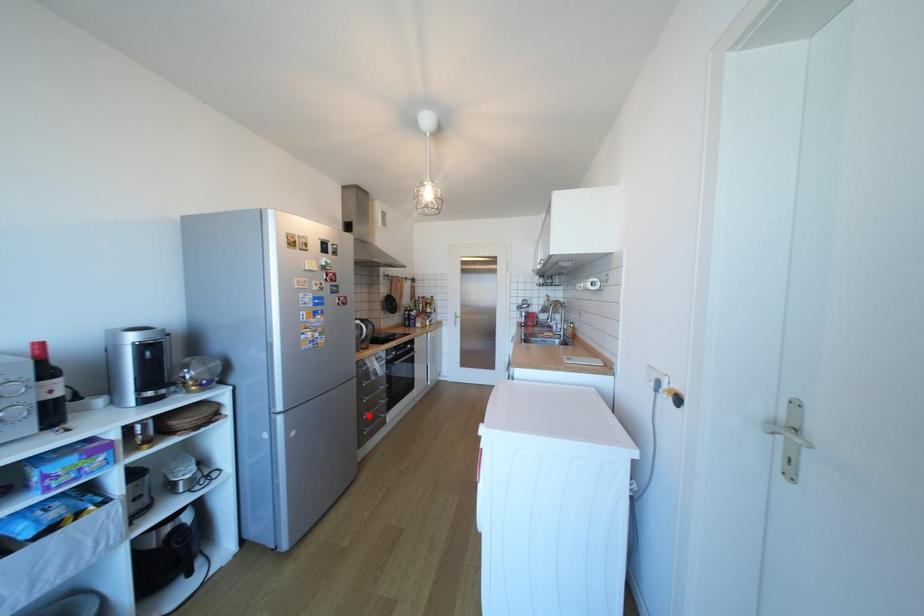
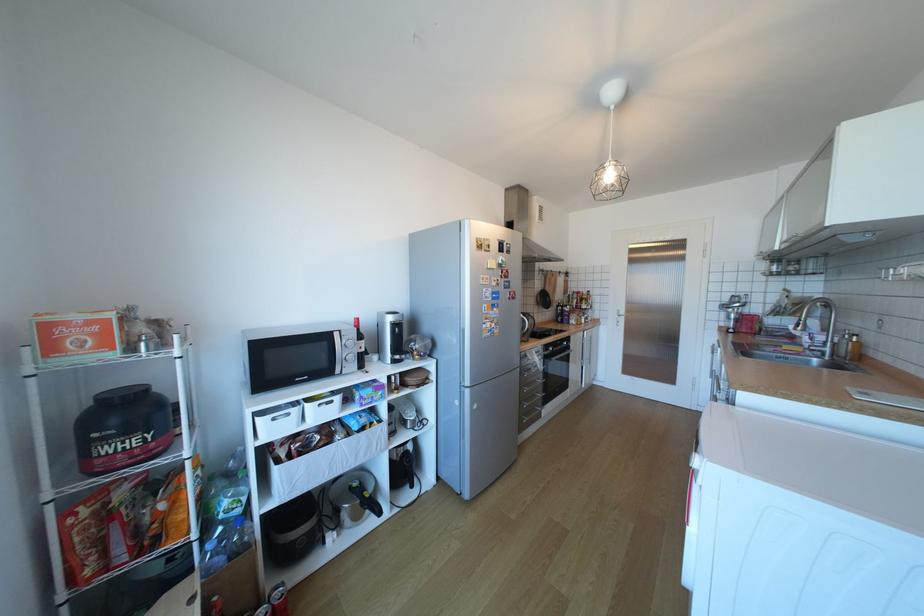
Find the pixel in the second image that matches the highlighted location in the first image.

(529, 403)